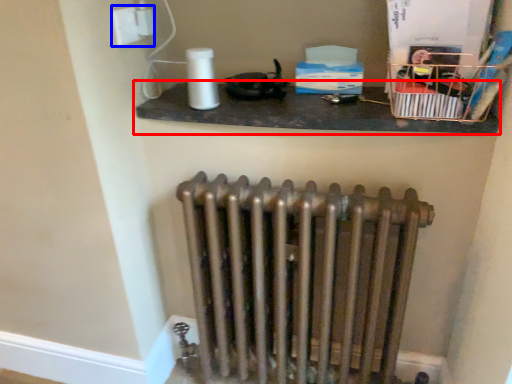
Question: Which object is closer to the camera taking this photo, shelf (highlighted by a red box) or electric outlet (highlighted by a blue box)?

Choices:
 (A) shelf
 (B) electric outlet

Answer: (A)